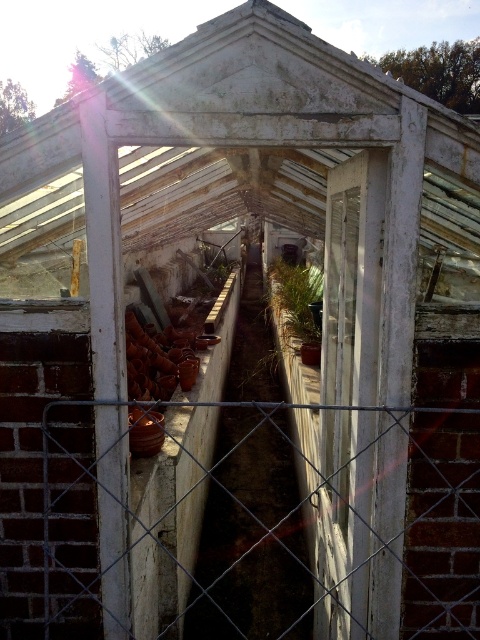
Does metal mesh fence at center have a lesser width compared to green matte plant at center?

Yes.

What do you see at coordinates (335, 408) in the screenshot? I see `metal mesh fence at center` at bounding box center [335, 408].

Between point (392, 554) and point (282, 276), which one is positioned behind?

Positioned behind is point (282, 276).

Find the location of a particular element. metal mesh fence at center is located at coordinates (335, 408).